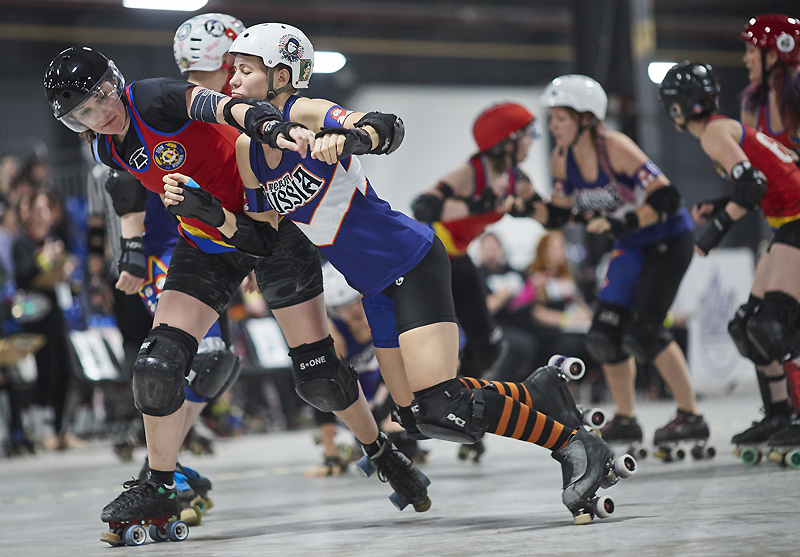
Identify the location of floor. The width and height of the screenshot is (800, 557). (578, 544).